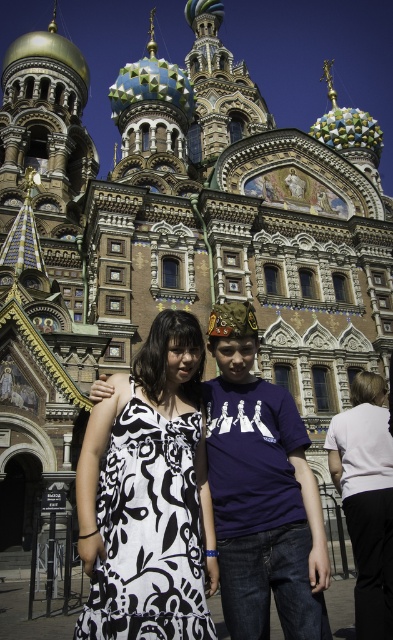
You are an architect analyzing the layout of the cathedral scene. You need to determine the exact position of the black printed dress at center in the image. What are its coordinates?

The black printed dress at center is located at coordinates point [148,497].